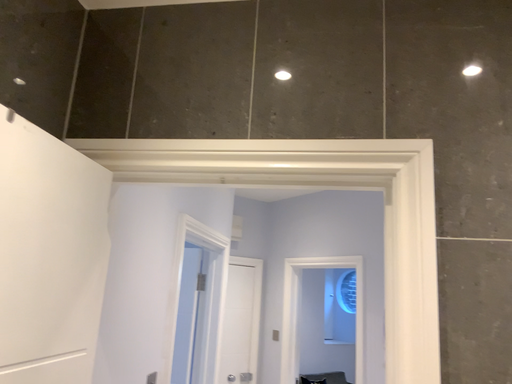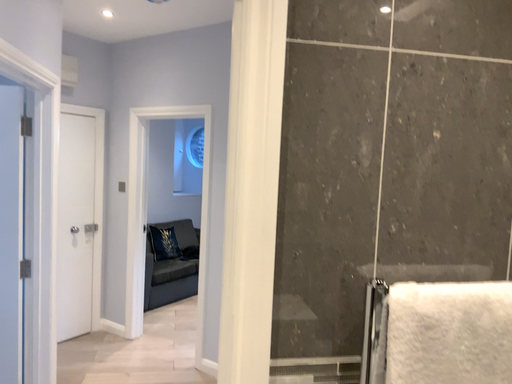
Question: How did the camera likely rotate when shooting the video?

Choices:
 (A) rotated left
 (B) rotated right

Answer: (B)